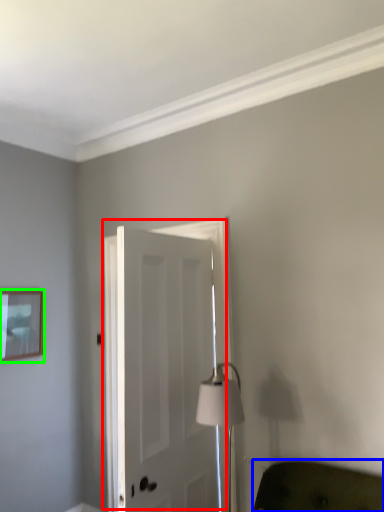
Question: Estimate the real-world distances between objects in this image. Which object is farther from door (highlighted by a red box), furniture (highlighted by a blue box) or picture frame (highlighted by a green box)?

Choices:
 (A) furniture
 (B) picture frame

Answer: (B)